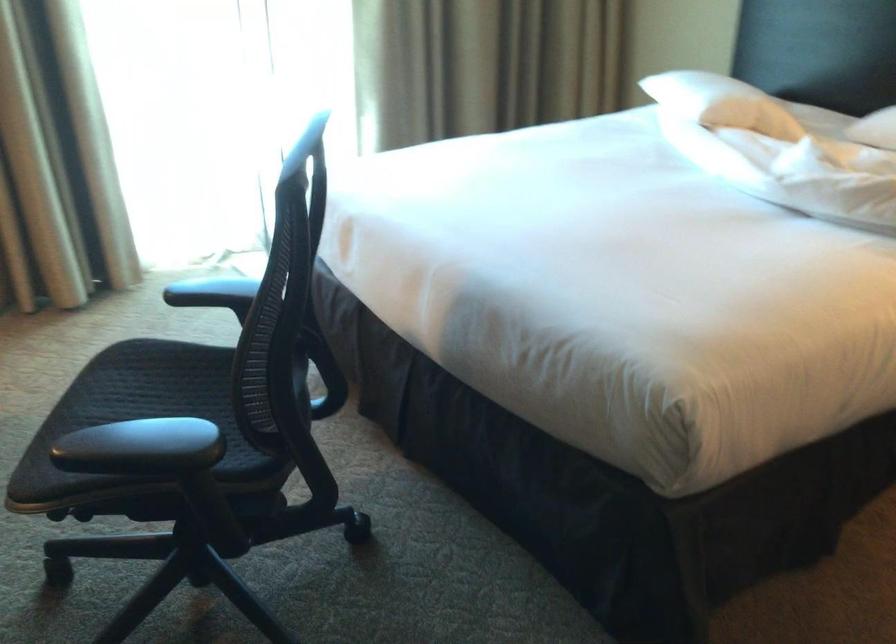
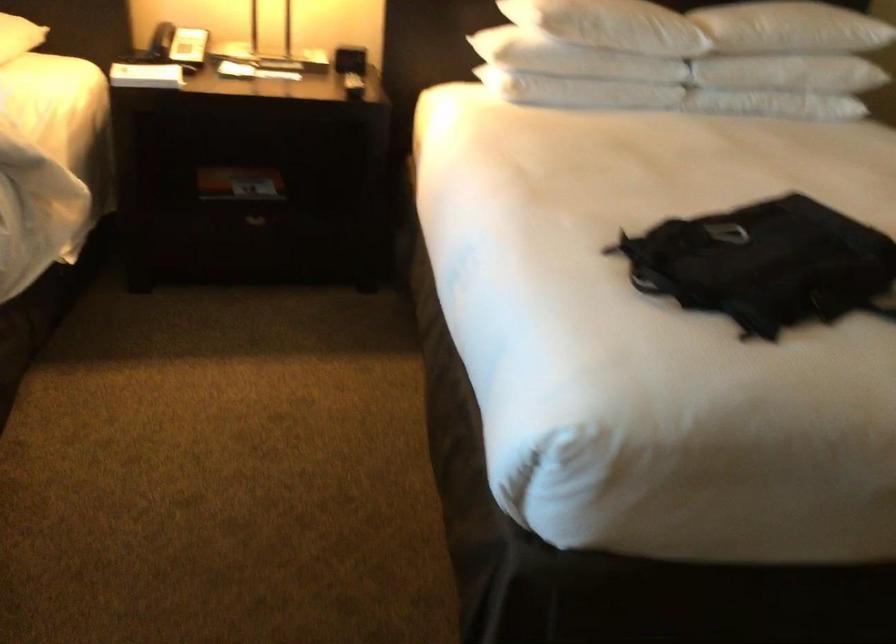
Question: The camera is either moving clockwise (left) or counter-clockwise (right) around the object. The first image is from the beginning of the video and the second image is from the end. Is the camera moving left or right when shooting the video?

Choices:
 (A) Left
 (B) Right

Answer: (A)